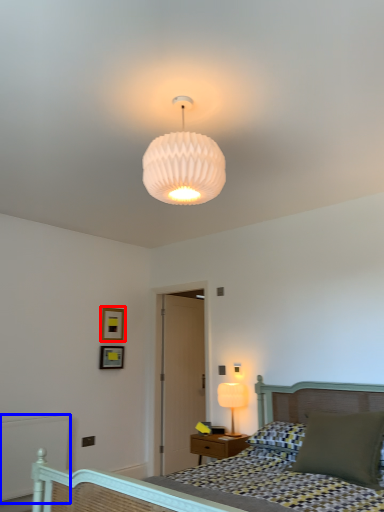
Question: Which of the following is the farthest to the observer, picture frame (highlighted by a red box) or balustrade (highlighted by a blue box)?

Choices:
 (A) picture frame
 (B) balustrade

Answer: (A)